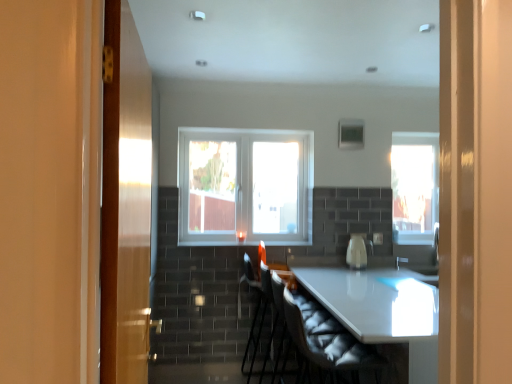
What do you see at coordinates (258, 298) in the screenshot? I see `white fabric armchair at center, arranged as the first armchair when viewed from the back` at bounding box center [258, 298].

Measure the distance between point (266, 281) and camera.

Point (266, 281) is 3.22 meters from camera.

The width and height of the screenshot is (512, 384). What do you see at coordinates (414, 186) in the screenshot? I see `transparent glass window at right, the 1th window from the right` at bounding box center [414, 186].

In order to click on white fabric swivel chair at center in this screenshot , I will do `click(328, 348)`.

Which object is thinner, wooden door at left or white fabric armchair at center, marked as the second armchair in a front-to-back arrangement?

wooden door at left.

Considering the positions of point (108, 278) and point (248, 378), is point (108, 278) closer or farther from the camera than point (248, 378)?

Point (108, 278) appears to be closer to the viewer than point (248, 378).

Would you say white fabric armchair at center, arranged as the first armchair when viewed from the back, is part of wooden door at left's contents?

No, white fabric armchair at center, arranged as the first armchair when viewed from the back, is not surrounded by wooden door at left.

Which of these two, wooden door at left or white fabric armchair at center, marked as the second armchair in a front-to-back arrangement, stands taller?

Standing taller between the two is wooden door at left.

Is wooden door at left located within white fabric swivel chair at center?

Actually, wooden door at left is outside white fabric swivel chair at center.

From the image's perspective, is white fabric swivel chair at center on wooden door at left?

No, from the image's perspective, white fabric swivel chair at center is not above wooden door at left.

Does white fabric swivel chair at center appear on the left side of wooden door at left?

No, white fabric swivel chair at center is not to the left of wooden door at left.

Is wooden door at left next to white fabric swivel chair at center?

There is a gap between wooden door at left and white fabric swivel chair at center.

Which is more distant, (117,379) or (321,373)?

The point (321,373) is farther from the camera.

From the image's perspective, who appears lower, wooden door at left or white fabric swivel chair at center?

white fabric swivel chair at center, from the image's perspective.

Is point (101, 311) closer to camera compared to point (373, 320)?

Yes.

Can you confirm if wooden door at left is thinner than white glossy table at center?

Correct, the width of wooden door at left is less than that of white glossy table at center.

Does wooden door at left have a greater height compared to white glossy table at center?

Indeed, wooden door at left has a greater height compared to white glossy table at center.

Identify the location of door on the left of white glossy table at center. The image size is (512, 384). (125, 202).

Can you confirm if white fabric armchair at center, arranged as the first armchair when viewed from the back, is positioned to the right of white glossy kettle at center?

No.

Considering the sizes of white fabric armchair at center, marked as the second armchair in a front-to-back arrangement, and white glossy kettle at center in the image, is white fabric armchair at center, marked as the second armchair in a front-to-back arrangement, wider or thinner than white glossy kettle at center?

In the image, white fabric armchair at center, marked as the second armchair in a front-to-back arrangement, appears to be wider than white glossy kettle at center.

Measure the distance from white fabric armchair at center, arranged as the first armchair when viewed from the back, to white glossy kettle at center.

white fabric armchair at center, arranged as the first armchair when viewed from the back, and white glossy kettle at center are 31.41 inches apart.

Could you tell me if white fabric armchair at center, arranged as the first armchair when viewed from the back, is facing white glossy kettle at center?

Yes, white fabric armchair at center, arranged as the first armchair when viewed from the back, faces towards white glossy kettle at center.

Image resolution: width=512 pixels, height=384 pixels. Find the location of `appliance on the right of clear glass window at center, positioned as the 1th window in front-to-back order`. appliance on the right of clear glass window at center, positioned as the 1th window in front-to-back order is located at coordinates (358, 251).

Considering the sizes of objects white glossy kettle at center and clear glass window at center, marked as the 2th window in a right-to-left arrangement, in the image provided, who is wider, white glossy kettle at center or clear glass window at center, marked as the 2th window in a right-to-left arrangement,?

white glossy kettle at center is wider.

Is white glossy kettle at center shorter than clear glass window at center, which is the 2th window in back-to-front order?

Indeed, white glossy kettle at center has a lesser height compared to clear glass window at center, which is the 2th window in back-to-front order.

Is point (362, 252) positioned behind point (243, 139)?

No, (362, 252) is in front of (243, 139).

Find the location of a particular element. swivel chair on the left side of transparent glass window at right, which is counted as the 2th window, starting from the left is located at coordinates (328, 348).

Does white fabric swivel chair at center have a greater width compared to transparent glass window at right, acting as the 1th window starting from the back?

Indeed, white fabric swivel chair at center has a greater width compared to transparent glass window at right, acting as the 1th window starting from the back.

Is white fabric swivel chair at center with transparent glass window at right, the 1th window from the right?

No, white fabric swivel chair at center is not with transparent glass window at right, the 1th window from the right.

Which is correct: white fabric swivel chair at center is inside transparent glass window at right, acting as the 1th window starting from the back, or outside of it?

white fabric swivel chair at center exists outside the volume of transparent glass window at right, acting as the 1th window starting from the back.

Where is `door that appears above the white fabric armchair at center, marked as the second armchair in a front-to-back arrangement (from a real-world perspective)`? This screenshot has width=512, height=384. door that appears above the white fabric armchair at center, marked as the second armchair in a front-to-back arrangement (from a real-world perspective) is located at coordinates (x=125, y=202).

Find the location of a particular element. The image size is (512, 384). door in front of the white fabric swivel chair at center is located at coordinates (125, 202).

Estimate the real-world distances between objects in this image. Which object is further from white fabric armchair at center, arranged as the first armchair when viewed from the back, clear glass window at center, positioned as the 1th window in front-to-back order, or white glossy kettle at center?

The object further to white fabric armchair at center, arranged as the first armchair when viewed from the back, is white glossy kettle at center.

Looking at the image, which one is located closer to velvet black armchair at center, marked as the 2th armchair in a back-to-front arrangement, clear glass window at center, positioned as the 1th window in front-to-back order, or white glossy kettle at center?

white glossy kettle at center is closer to velvet black armchair at center, marked as the 2th armchair in a back-to-front arrangement.

Consider the image. Based on their spatial positions, is white glossy table at center or velvet black armchair at center, the first armchair in the front-to-back sequence, closer to white fabric armchair at center, marked as the second armchair in a front-to-back arrangement?

The object closer to white fabric armchair at center, marked as the second armchair in a front-to-back arrangement, is white glossy table at center.

Looking at the image, which one is located closer to wooden door at left, transparent glass window at right, acting as the 1th window starting from the back, or clear glass window at center, marked as the 2th window in a right-to-left arrangement?

The object closer to wooden door at left is clear glass window at center, marked as the 2th window in a right-to-left arrangement.

When comparing their distances from white glossy kettle at center, does white fabric swivel chair at center or velvet black armchair at center, the first armchair in the front-to-back sequence, seem further?

velvet black armchair at center, the first armchair in the front-to-back sequence, is further to white glossy kettle at center.

Based on their spatial positions, is transparent glass window at right, which is counted as the 2th window, starting from the left, or clear glass window at center, marked as the 2th window in a right-to-left arrangement, closer to white glossy table at center?

clear glass window at center, marked as the 2th window in a right-to-left arrangement, is closer to white glossy table at center.

Looking at the image, which one is located further to clear glass window at center, marked as the 2th window in a right-to-left arrangement, velvet black armchair at center, marked as the 2th armchair in a back-to-front arrangement, or white glossy kettle at center?

velvet black armchair at center, marked as the 2th armchair in a back-to-front arrangement, lies further to clear glass window at center, marked as the 2th window in a right-to-left arrangement, than the other object.

Considering their positions, is white fabric armchair at center, arranged as the first armchair when viewed from the back, positioned closer to white glossy table at center than transparent glass window at right, acting as the 1th window starting from the back?

Among the two, white fabric armchair at center, arranged as the first armchair when viewed from the back, is located nearer to white glossy table at center.

Identify the location of appliance between clear glass window at center, which is the 2th window in back-to-front order, and white fabric armchair at center, arranged as the first armchair when viewed from the back, in the up-down direction. This screenshot has width=512, height=384. (358, 251).

Where is `armchair between white fabric swivel chair at center and white fabric armchair at center, arranged as the first armchair when viewed from the back, from front to back`? armchair between white fabric swivel chair at center and white fabric armchair at center, arranged as the first armchair when viewed from the back, from front to back is located at coordinates (276, 308).

Image resolution: width=512 pixels, height=384 pixels. I want to click on swivel chair between wooden door at left and clear glass window at center, positioned as the 1th window in front-to-back order, in the front-back direction, so click(x=328, y=348).

Image resolution: width=512 pixels, height=384 pixels. In order to click on armchair located between white fabric armchair at center, marked as the second armchair in a front-to-back arrangement, and white glossy kettle at center in the left-right direction in this screenshot , I will do `click(276, 308)`.